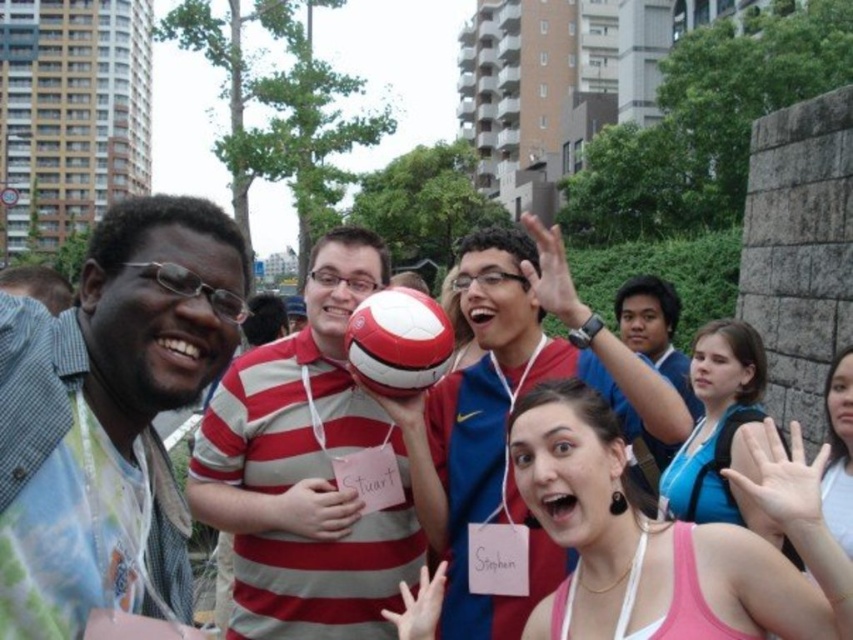
Which is in front, point (10, 452) or point (202, 474)?

Point (10, 452) is more forward.

Measure the distance between point (x=144, y=232) and camera.

Point (x=144, y=232) is 53.26 feet from camera.

Is point (80, 376) behind point (349, 403)?

No, it is in front of (349, 403).

Where is `matte black shirt at left`? The width and height of the screenshot is (853, 640). matte black shirt at left is located at coordinates (109, 368).

Based on the photo, is matte black shirt at left shorter than red and white soccer ball at center?

Yes, matte black shirt at left is shorter than red and white soccer ball at center.

Is matte black shirt at left below red and white soccer ball at center?

No, matte black shirt at left is not below red and white soccer ball at center.

The image size is (853, 640). I want to click on matte black shirt at left, so click(109, 368).

Identify the location of matte black shirt at left. (109, 368).

Who is more distant from viewer, (x=228, y=461) or (x=445, y=342)?

The point (x=228, y=461) is more distant.

Is point (288, 557) positioned in front of point (399, 369)?

No, (288, 557) is further to viewer.

Is point (293, 564) positioned before point (387, 349)?

That is False.

Where is `striped cotton polo shirt at center`? The image size is (853, 640). striped cotton polo shirt at center is located at coordinates (306, 468).